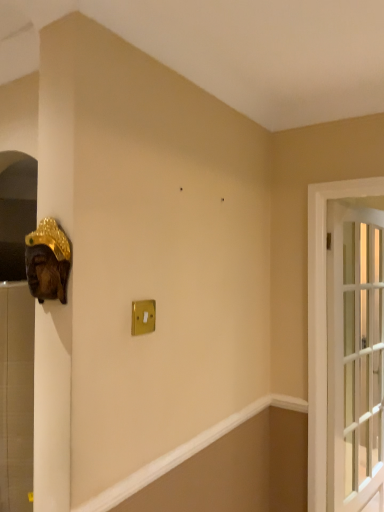
Question: Does wooden mask at left have a larger size compared to gold metallic light switch at center?

Choices:
 (A) yes
 (B) no

Answer: (A)

Question: Is wooden mask at left shorter than gold metallic light switch at center?

Choices:
 (A) no
 (B) yes

Answer: (A)

Question: Is wooden mask at left at the left side of gold metallic light switch at center?

Choices:
 (A) no
 (B) yes

Answer: (B)

Question: Is gold metallic light switch at center surrounded by wooden mask at left?

Choices:
 (A) yes
 (B) no

Answer: (B)

Question: Is wooden mask at left positioned behind gold metallic light switch at center?

Choices:
 (A) no
 (B) yes

Answer: (A)

Question: Is gold metallic light switch at center wider or thinner than clear glass door at right?

Choices:
 (A) wide
 (B) thin

Answer: (B)

Question: From the image's perspective, is gold metallic light switch at center above or below clear glass door at right?

Choices:
 (A) above
 (B) below

Answer: (A)

Question: In terms of size, does gold metallic light switch at center appear bigger or smaller than clear glass door at right?

Choices:
 (A) big
 (B) small

Answer: (B)

Question: From a real-world perspective, is gold metallic light switch at center above or below clear glass door at right?

Choices:
 (A) below
 (B) above

Answer: (B)

Question: Is wooden mask at left inside or outside of gold metallic light switch at center?

Choices:
 (A) outside
 (B) inside

Answer: (A)

Question: Is wooden mask at left wider or thinner than gold metallic light switch at center?

Choices:
 (A) thin
 (B) wide

Answer: (B)

Question: Does point [x=69, y=249] appear closer or farther from the camera than point [x=139, y=313]?

Choices:
 (A) farther
 (B) closer

Answer: (B)

Question: Relative to gold metallic light switch at center, is wooden mask at left in front or behind?

Choices:
 (A) behind
 (B) front

Answer: (B)

Question: Do you think wooden mask at left is within clear glass door at right, or outside of it?

Choices:
 (A) inside
 (B) outside

Answer: (B)

Question: From their relative heights in the image, would you say wooden mask at left is taller or shorter than clear glass door at right?

Choices:
 (A) short
 (B) tall

Answer: (A)